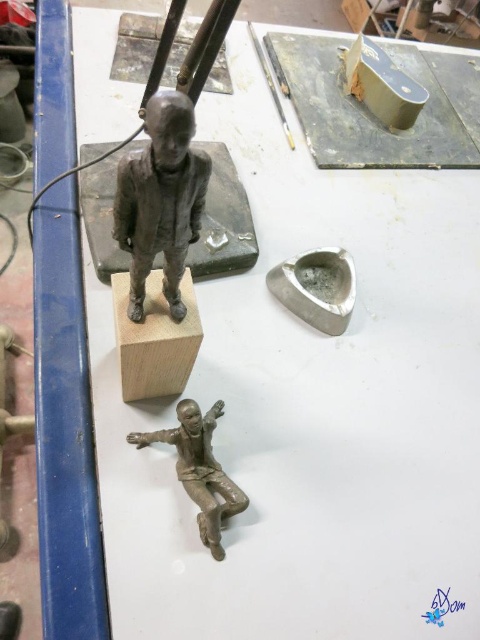
You are an art curator arranging an exhibition. You need to determine the spatial relationship between the bronze statue at center and the matte bronze figure at lower center. Based on the scene, which one is closer to the viewer?

The bronze statue at center is closer to the viewer because it is in front of the matte bronze figure at lower center.

You are an art curator planning to move the bronze statue at center and the matte bronze figure at lower center to a new exhibition space. The transport box can only accommodate items up to 10 cm in thickness. Which of the two sculptures is more likely to exceed the box limit based on their thickness?

The matte bronze figure at lower center is thicker than the bronze statue at center, so it is more likely to exceed the transport box limit of 10 cm in thickness.

You are standing in front of the workspace and want to determine the relative positions of two points marked on the table. Which point is closer to you, point (168,131) or point (197,493)?

Point (168,131) is closer to the viewer than point (197,493).